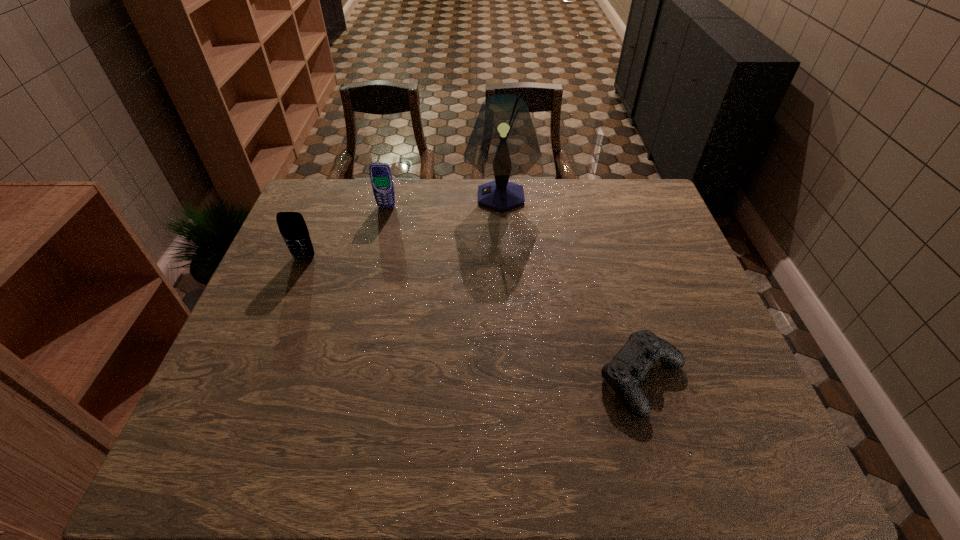
This screenshot has width=960, height=540. What are the coordinates of `unoccupied position between the lampshade and the right cellular telephone` in the screenshot? It's located at (444, 201).

Where is `unoccupied position between the nearer cellular telephone and the second object from left to right`? unoccupied position between the nearer cellular telephone and the second object from left to right is located at coordinates (346, 232).

Select which object is the second closest to the lampshade. Please provide its 2D coordinates. Your answer should be formatted as a tuple, i.e. [(x, y)], where the tuple contains the x and y coordinates of a point satisfying the conditions above.

[(292, 226)]

What are the coordinates of `object that can be found as the closest to the control` in the screenshot? It's located at (503, 142).

Locate an element on the screen. The width and height of the screenshot is (960, 540). vacant region that satisfies the following two spatial constraints: 1. on the base of the tallest object; 2. on the right side of the nearest object is located at coordinates (x=511, y=379).

Find the location of a particular element. free spot that satisfies the following two spatial constraints: 1. on the screen of the control; 2. on the left side of the leftmost object is located at coordinates (255, 379).

Locate an element on the screen. The height and width of the screenshot is (540, 960). vacant space that satisfies the following two spatial constraints: 1. on the base of the lampshade; 2. on the screen of the left cellular telephone is located at coordinates (504, 258).

The width and height of the screenshot is (960, 540). What are the coordinates of `free point that satisfies the following two spatial constraints: 1. on the base of the third object from left to right; 2. on the screen of the nearer cellular telephone` in the screenshot? It's located at (504, 258).

Locate an element on the screen. Image resolution: width=960 pixels, height=540 pixels. free spot that satisfies the following two spatial constraints: 1. on the base of the tallest object; 2. on the front-facing side of the right cellular telephone is located at coordinates (501, 206).

In order to click on vacant space that satisfies the following two spatial constraints: 1. on the back side of the nearest object; 2. on the base of the second object from right to left in this screenshot , I will do `click(589, 197)`.